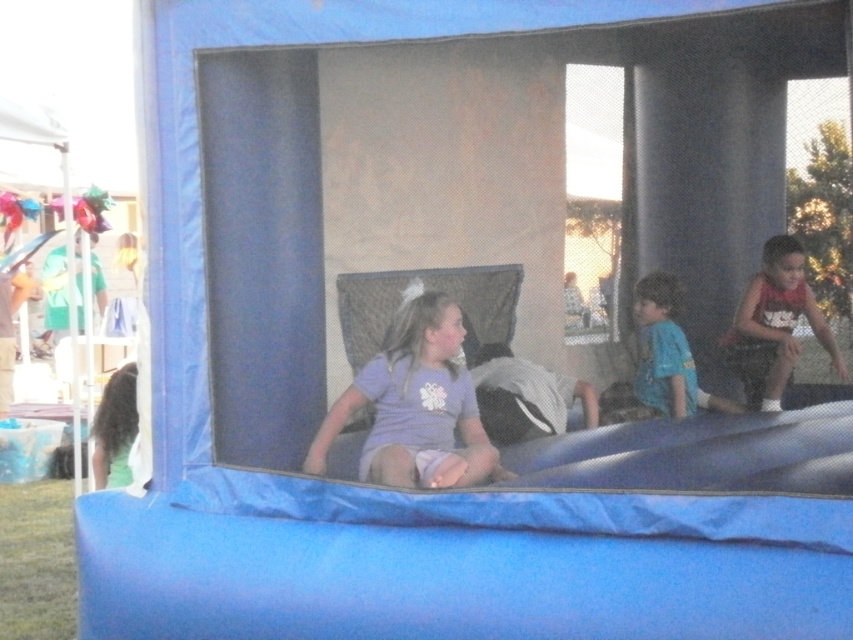
Question: Is reddish-brown tank top at right positioned behind blue cotton shirt at center?

Choices:
 (A) yes
 (B) no

Answer: (A)

Question: Which object is the farthest from the purple matte shirt at center?

Choices:
 (A) reddish-brown tank top at right
 (B) blue cotton shirt at center

Answer: (A)

Question: Can you confirm if purple matte shirt at center is smaller than reddish-brown tank top at right?

Choices:
 (A) yes
 (B) no

Answer: (A)

Question: Does purple matte shirt at center have a lesser width compared to blue cotton shirt at center?

Choices:
 (A) yes
 (B) no

Answer: (B)

Question: Among these objects, which one is farthest from the camera?

Choices:
 (A) purple matte shirt at center
 (B) reddish-brown tank top at right
 (C) blue cotton shirt at center

Answer: (B)

Question: Which point appears farthest from the camera in this image?

Choices:
 (A) (772, 321)
 (B) (646, 344)
 (C) (448, 445)

Answer: (A)